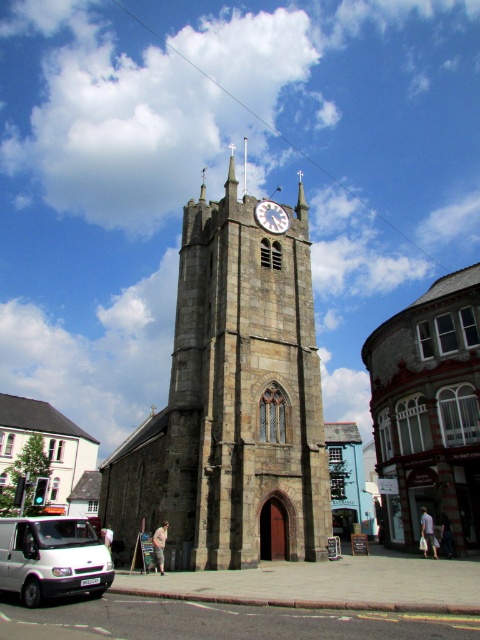
Question: Can you confirm if stone church at center is positioned above white glossy clock at upper center?

Choices:
 (A) no
 (B) yes

Answer: (A)

Question: Does stone church at center have a lesser width compared to white glossy clock at upper center?

Choices:
 (A) no
 (B) yes

Answer: (A)

Question: Is stone clock tower at center thinner than white glossy clock at upper center?

Choices:
 (A) no
 (B) yes

Answer: (A)

Question: Based on their relative distances, which object is nearer to the white glossy clock at upper center?

Choices:
 (A) stone clock tower at center
 (B) white matte van at lower left

Answer: (A)

Question: Estimate the real-world distances between objects in this image. Which object is farther from the stone clock tower at center?

Choices:
 (A) white glossy clock at upper center
 (B) stone church at center
 (C) white matte van at lower left

Answer: (C)

Question: Which object is positioned farthest from the stone church at center?

Choices:
 (A) white glossy clock at upper center
 (B) stone clock tower at center

Answer: (B)